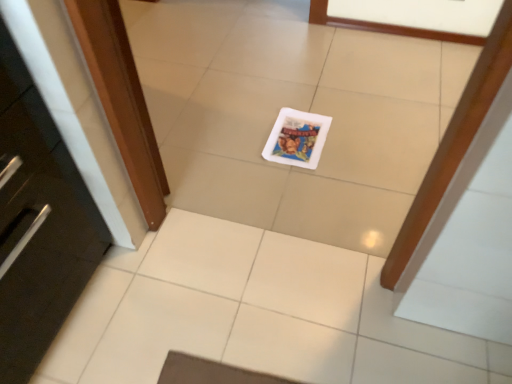
You are a GUI agent. You are given a task and a screenshot of the screen. Output one action in this format:
    pyautogui.click(x=<x>, y=<y>)
    Task: Click on the vacant space to the left of white matte postcard at center
    
    Given the screenshot: What is the action you would take?
    pyautogui.click(x=240, y=144)